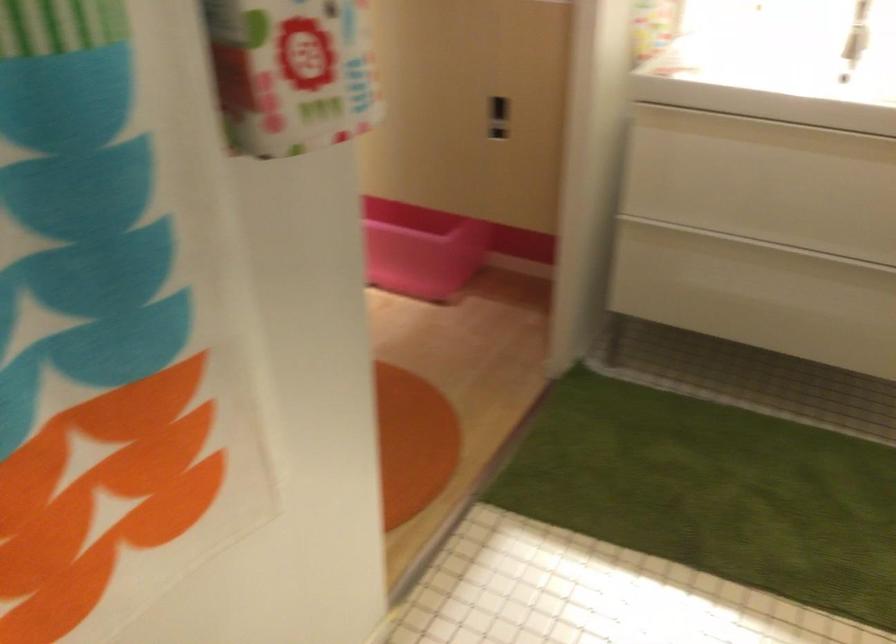
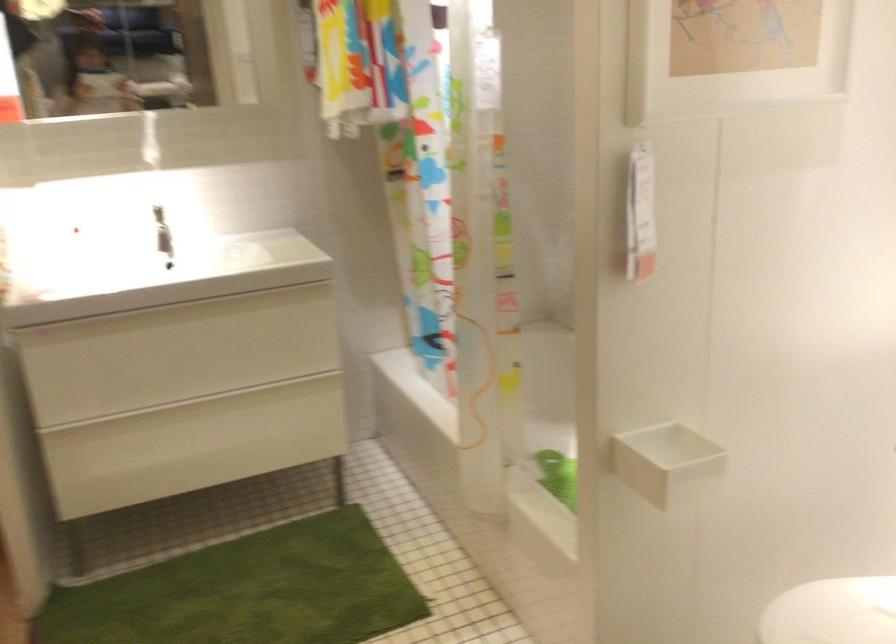
Question: The first image is from the beginning of the video and the second image is from the end. How did the camera likely rotate when shooting the video?

Choices:
 (A) Left
 (B) Right
 (C) Up
 (D) Down

Answer: (B)